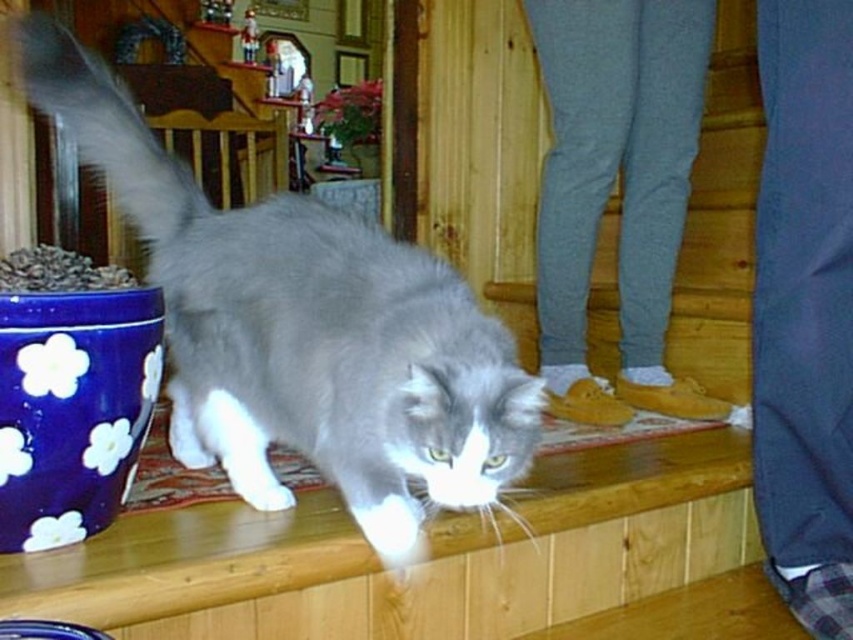
Measure the distance between point (496, 452) and camera.

Point (496, 452) is 34.26 inches away from camera.

Identify the location of gray fluffy cat at center. The height and width of the screenshot is (640, 853). pyautogui.click(x=300, y=326).

Can you confirm if dark blue fabric pants at lower right is shorter than fluffy white tail at upper left?

No, dark blue fabric pants at lower right is not shorter than fluffy white tail at upper left.

Does dark blue fabric pants at lower right appear under fluffy white tail at upper left?

Indeed, dark blue fabric pants at lower right is positioned under fluffy white tail at upper left.

Identify the location of dark blue fabric pants at lower right. (805, 308).

Where is `dark blue fabric pants at lower right`? This screenshot has width=853, height=640. dark blue fabric pants at lower right is located at coordinates (805, 308).

Between wooden ledge at center and fluffy white tail at upper left, which one has more height?

fluffy white tail at upper left

Can you confirm if wooden ledge at center is wider than fluffy white tail at upper left?

Correct, the width of wooden ledge at center exceeds that of fluffy white tail at upper left.

Does point (125, 547) come closer to viewer compared to point (57, 33)?

Yes, point (125, 547) is closer to viewer.

You are a GUI agent. You are given a task and a screenshot of the screen. Output one action in this format:
    pyautogui.click(x=<x>, y=<y>)
    Task: Click on the wooden ledge at center
    
    Given the screenshot: What is the action you would take?
    pyautogui.click(x=421, y=566)